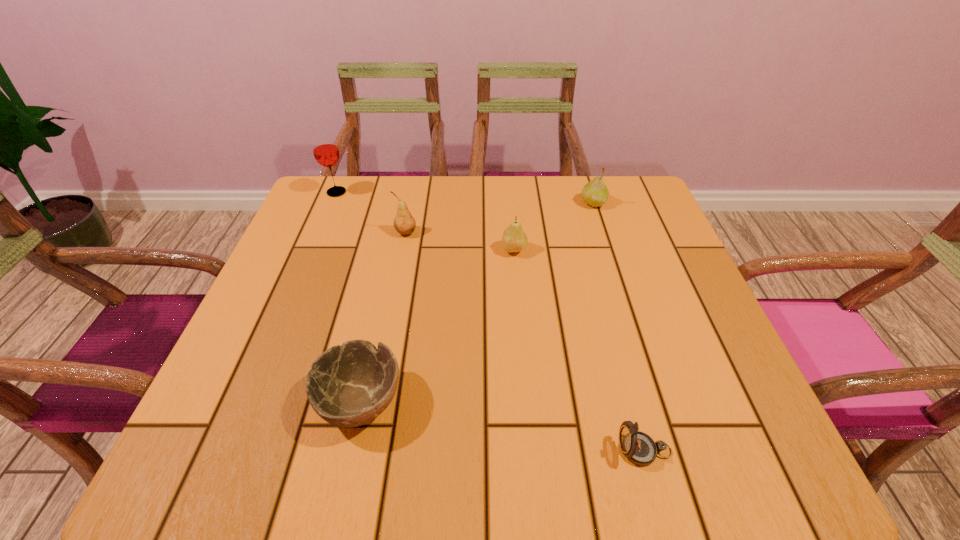
This screenshot has height=540, width=960. I want to click on the tallest object, so click(324, 146).

Find the location of a particular element. This screenshot has height=540, width=960. the leftmost object is located at coordinates pyautogui.click(x=324, y=146).

This screenshot has height=540, width=960. I want to click on the farthest pear, so click(x=595, y=193).

Identify the location of the leftmost pear. The width and height of the screenshot is (960, 540). (404, 223).

The image size is (960, 540). In order to click on the second nearest pear in this screenshot , I will do `click(404, 223)`.

At what (x,y) coordinates should I click in order to perform the action: click on the third shortest object. Please return your answer as a coordinate pair (x, y). The height and width of the screenshot is (540, 960). Looking at the image, I should click on (514, 239).

Locate an element on the screen. This screenshot has height=540, width=960. the second pear from left to right is located at coordinates (514, 239).

This screenshot has width=960, height=540. Identify the location of bowl. (349, 385).

What are the coordinates of `compass` in the screenshot? It's located at coord(639,448).

This screenshot has height=540, width=960. Identify the location of free region located 0.140m on the front of the leftmost object. (321, 231).